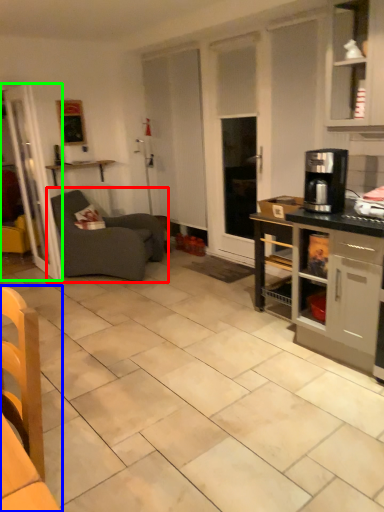
Question: Which object is positioned farthest from studio couch (highlighted by a red box)? Select from chair (highlighted by a blue box) and glass door (highlighted by a green box).

Choices:
 (A) chair
 (B) glass door

Answer: (A)